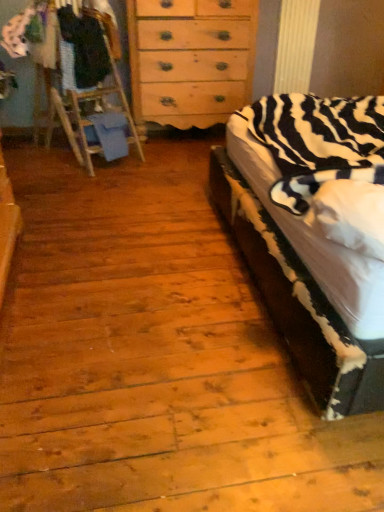
Question: From the image's perspective, does zebra-patterned fabric at right appear lower than light brown wooden dresser at center?

Choices:
 (A) no
 (B) yes

Answer: (B)

Question: Does zebra-patterned fabric at right lie behind light brown wooden dresser at center?

Choices:
 (A) yes
 (B) no

Answer: (B)

Question: Is zebra-patterned fabric at right turned away from light brown wooden dresser at center?

Choices:
 (A) no
 (B) yes

Answer: (A)

Question: Is zebra-patterned fabric at right surrounding light brown wooden dresser at center?

Choices:
 (A) no
 (B) yes

Answer: (A)

Question: Would you say zebra-patterned fabric at right is a long distance from light brown wooden dresser at center?

Choices:
 (A) no
 (B) yes

Answer: (B)

Question: Can you confirm if zebra-patterned fabric at right is wider than light brown wooden dresser at center?

Choices:
 (A) yes
 (B) no

Answer: (A)

Question: Is zebra-patterned fabric at right located within white cotton shirt at upper left, placed as the 2th clothing when sorted from right to left?

Choices:
 (A) yes
 (B) no

Answer: (B)

Question: Is white cotton shirt at upper left, placed as the 2th clothing when sorted from right to left, oriented towards zebra-patterned fabric at right?

Choices:
 (A) no
 (B) yes

Answer: (A)

Question: Is the position of white cotton shirt at upper left, arranged as the first clothing when viewed from the left, more distant than that of zebra-patterned fabric at right?

Choices:
 (A) no
 (B) yes

Answer: (B)

Question: Is white cotton shirt at upper left, arranged as the first clothing when viewed from the left, turned away from zebra-patterned fabric at right?

Choices:
 (A) yes
 (B) no

Answer: (B)

Question: Considering the relative sizes of white cotton shirt at upper left, placed as the 2th clothing when sorted from right to left, and zebra-patterned fabric at right in the image provided, is white cotton shirt at upper left, placed as the 2th clothing when sorted from right to left, taller than zebra-patterned fabric at right?

Choices:
 (A) yes
 (B) no

Answer: (B)

Question: From the image's perspective, is white cotton shirt at upper left, arranged as the first clothing when viewed from the left, on top of zebra-patterned fabric at right?

Choices:
 (A) no
 (B) yes

Answer: (B)

Question: Considering the relative positions of white cotton shirt at upper left, placed as the 2th clothing when sorted from right to left, and dark blue fabric at left, the 1th clothing from the right, in the image provided, is white cotton shirt at upper left, placed as the 2th clothing when sorted from right to left, to the right of dark blue fabric at left, the 1th clothing from the right, from the viewer's perspective?

Choices:
 (A) no
 (B) yes

Answer: (A)